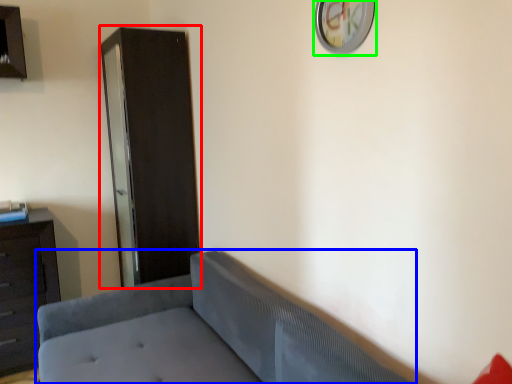
Question: Considering the real-world distances, which object is closest to file cabinet (highlighted by a red box)? studio couch (highlighted by a blue box) or clock (highlighted by a green box).

Choices:
 (A) studio couch
 (B) clock

Answer: (A)